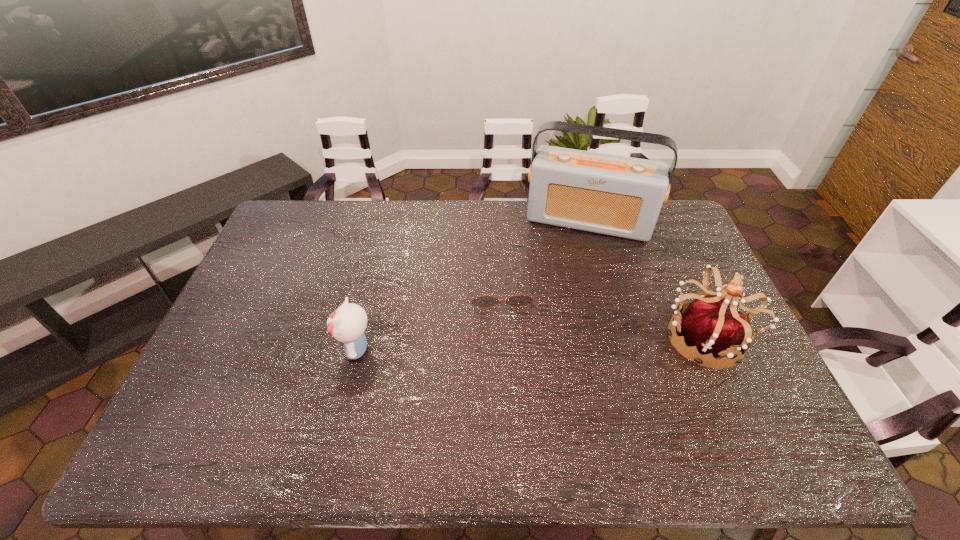
The image size is (960, 540). I want to click on vacant space on the desktop that is between the third tallest object and the tiara and is positioned on the front-facing side of the farthest object, so click(564, 343).

Identify the location of free space on the desktop that is between the third tallest object and the third shortest object and is positioned on the face of the shortest object. (506, 345).